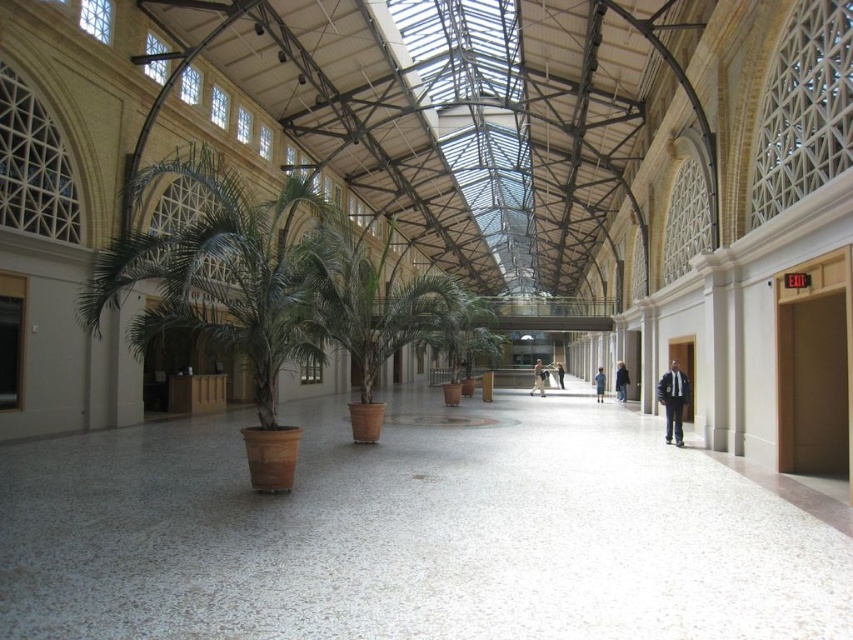
You are a delivery person carrying a box that requires placing on a surface at least as tall as the dark blue jeans at center. Can you use the brown terracotta pot at left as a surface for the box?

The brown terracotta pot at left has a greater height compared to the dark blue jeans at center, so it is taller than the required height. Therefore, you can place the box on the brown terracotta pot at left.

In the scene shown: You are standing at the entrance of the corridor and see the point marked as point [227,291]. What object is located at that point?

The point [227,291] corresponds to the brown terracotta pot at left.

You are standing in the corridor and see the green matte palm tree at center and the dark blue jeans at center. Which object is located to the left of the other?

The green matte palm tree at center is positioned on the left side of dark blue jeans at center.